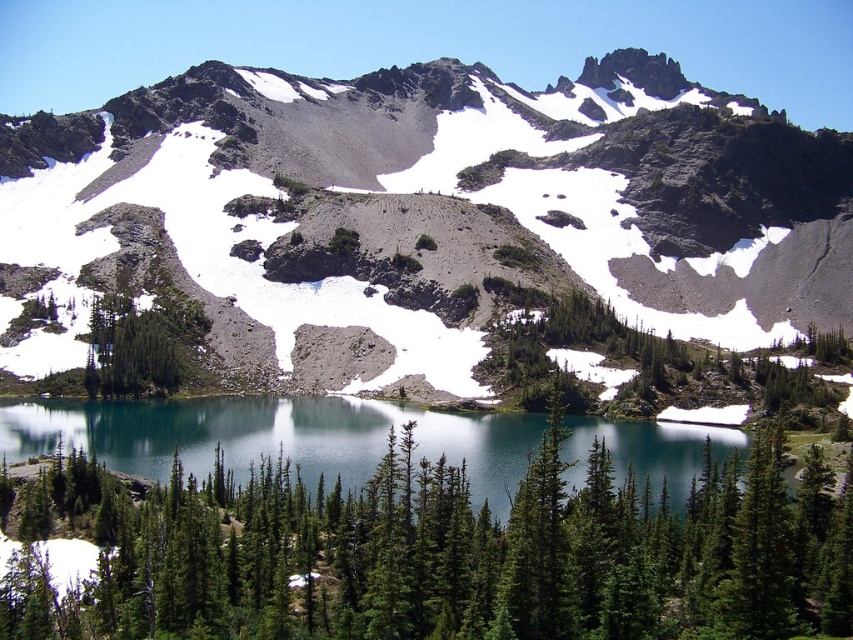
From the picture: You are planning to take a photo of the rugged granite mountain at center and the green matte tree at center from a viewpoint that can see both. Which object will appear bigger in your photo?

The rugged granite mountain at center will appear bigger in the photo because it is larger in size than the green matte tree at center.

You are standing at the point marked by the coordinates point (434,552) in the alpine landscape. Which object are you standing on?

You are standing on the green matte tree at center.